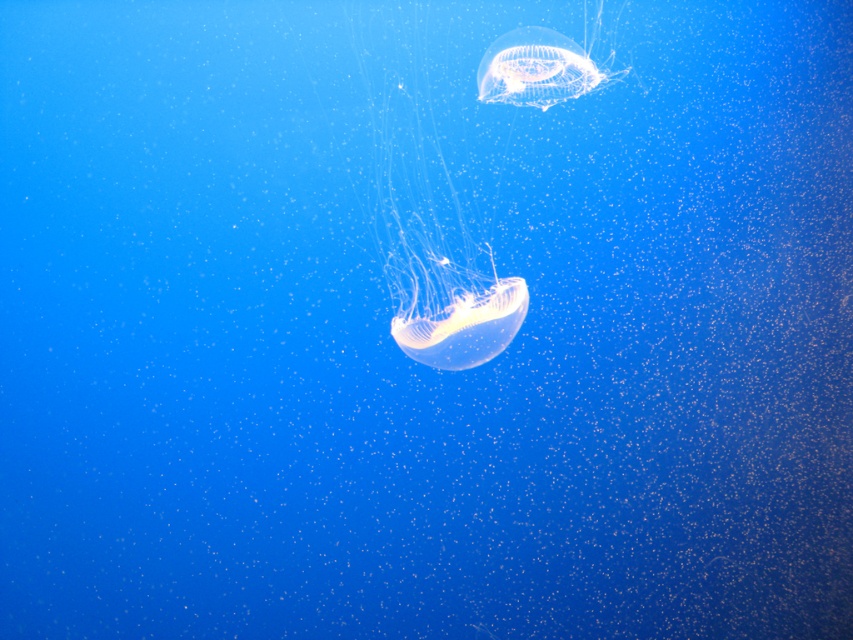
You are a marine biologist observing the underwater scene. You notice two gelatinous creatures, the translucent gelatinous at center and the transparent gelatinous at upper center. Which one is positioned lower in the water?

The translucent gelatinous at center is positioned lower than the transparent gelatinous at upper center.

Looking at this image, you are a marine biologist observing underwater. You have a camera and want to take a closeup photo of the translucent gelatinous at center. The camera has a minimum focusing distance of 1.5 meters. Can you take the photo without moving closer?

The translucent gelatinous at center is 1.91 meters from camera, so yes, you can take the photo without moving closer since the distance is within the camera minimum focusing distance of 1.5 meters.